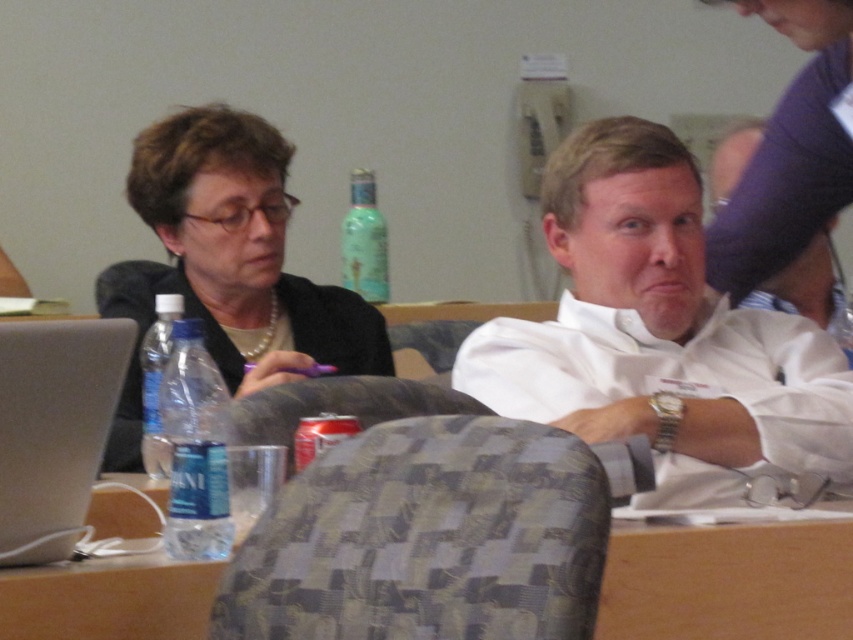
You are standing in the conference room and see the pearl necklace at left. Can you tell me what object is located at the coordinates point (227, 264)?

The point (227, 264) is on the pearl necklace at left.

You are standing in the conference room and want to pick up the pearl necklace at left without moving the textured fabric chair at center. Is this possible given their positions?

The textured fabric chair at center is closer to the viewer than the pearl necklace at left, so you can reach the pearl necklace at left without moving the chair since it is further away.

You are a person who is 1.7 meters tall and wants to sit on the textured fabric chair at center. However, there is a pearl necklace at left nearby. Considering the height difference between these two objects, will sitting on the chair affect the necklace?

The textured fabric chair at center has a lesser height compared to pearl necklace at left. Since the chair is shorter than the necklace, sitting on it would not cause any interference with the pearl necklace at left.